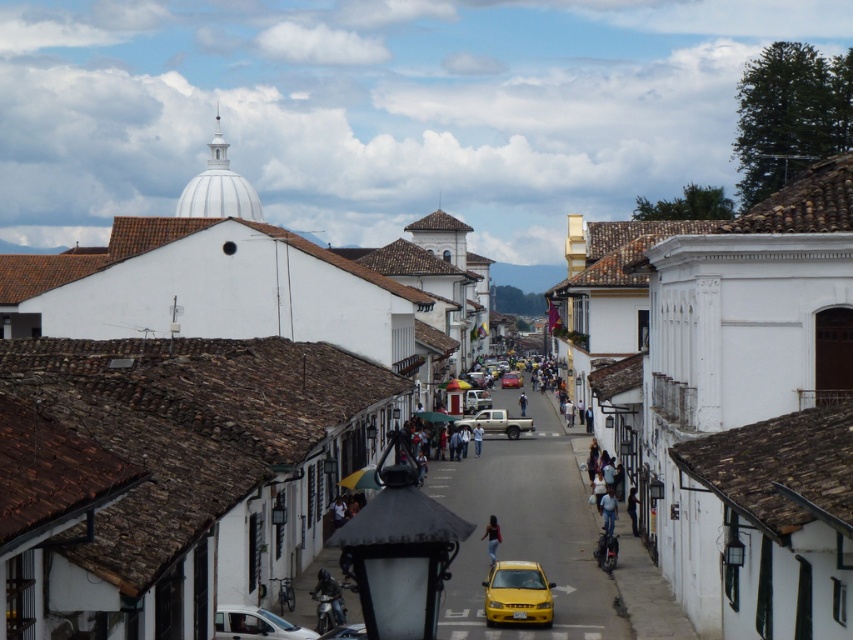
You are standing on a balcony overlooking the historic town street. You notice the dark blue jeans at center. Based on their position, can you estimate whether they are closer to the front or the back of the visible street scene?

The dark blue jeans at center is located at point (631,509), which places it closer to the front of the visible street scene.

You are a tailor who needs to determine which pair of jeans can fit a customer who requires a size larger than the other. Looking at the denim jeans at center and the light blue jeans at center in the image, which one should you recommend?

The denim jeans at center has a larger size compared to the light blue jeans at center, so you should recommend the denim jeans at center.